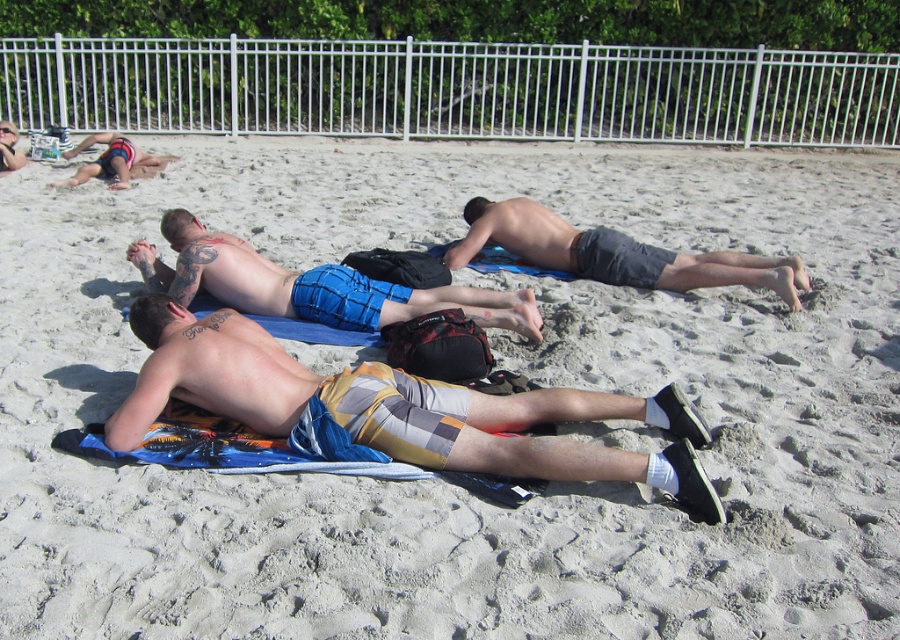
Based on the scene description, where exactly is the plaid shorts at center located in the image?

The plaid shorts at center is located at point 0.639 in the x coordinate and 0.440 in the y coordinate.

You are a photographer standing at the beach. You want to take a photo of the blue plaid shorts at center and dark gray shorts at center. Which one should you focus on first to ensure it appears sharp in the photo?

The blue plaid shorts at center is closer to the viewer than dark gray shorts at center, so you should focus on the blue plaid shorts at center first to ensure it appears sharp in the photo.

Looking at this image, you are a photographer trying to capture the plaid shorts at center and the matte black shorts at upper left in a single frame. Which of the two pairs of shorts is positioned closer to the camera?

The plaid shorts at center is below matte black shorts at upper left, so the plaid shorts at center is closer to the camera.